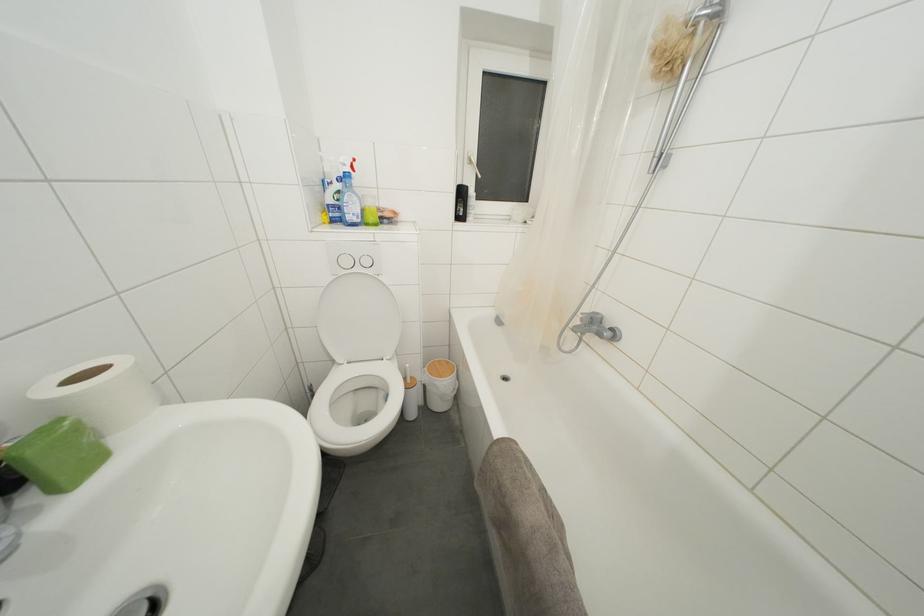
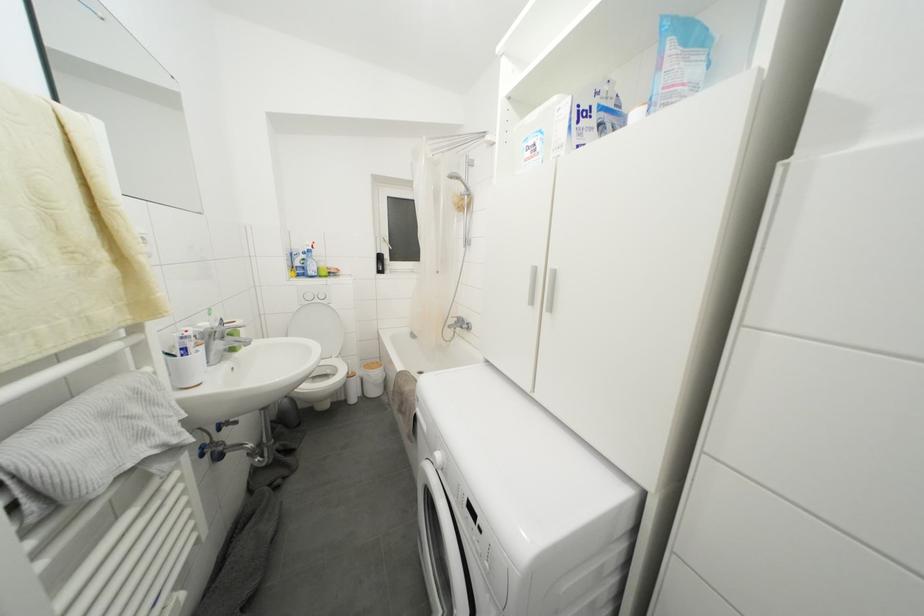
Question: In a continuous first-person perspective shot, in which direction is the camera moving?

Choices:
 (A) Left
 (B) Right
 (C) Forward
 (D) Backward

Answer: (D)